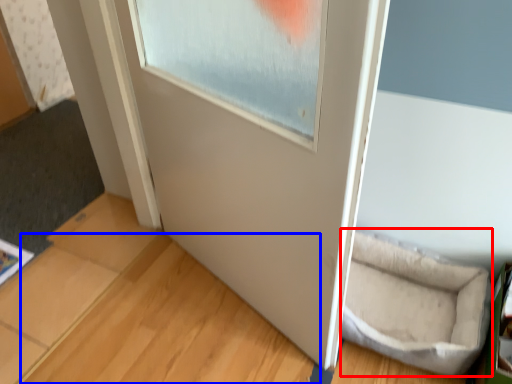
Question: Among these objects, which one is nearest to the camera, wide (highlighted by a red box) or wood (highlighted by a blue box)?

Choices:
 (A) wide
 (B) wood

Answer: (B)